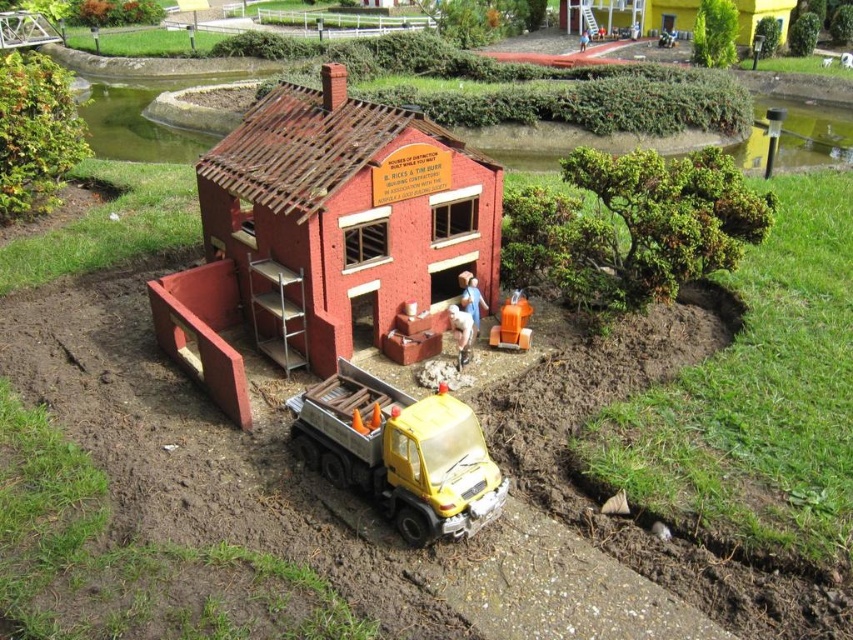
Question: Which of the following is the farthest from the observer?

Choices:
 (A) brick textured house at center
 (B) matte brick house at upper right
 (C) orange plastic barrel at center

Answer: (B)

Question: Does brick textured house at center appear on the left side of orange plastic barrel at center?

Choices:
 (A) no
 (B) yes

Answer: (B)

Question: Among these points, which one is nearest to the camera?

Choices:
 (A) (512, 348)
 (B) (758, 10)

Answer: (A)

Question: Which object is closer to the camera taking this photo?

Choices:
 (A) brick textured house at center
 (B) matte brick house at upper right

Answer: (A)

Question: Is brick textured house at center below yellow matte truck at lower center?

Choices:
 (A) yes
 (B) no

Answer: (B)

Question: Is yellow matte truck at lower center bigger than matte brick house at upper right?

Choices:
 (A) no
 (B) yes

Answer: (A)